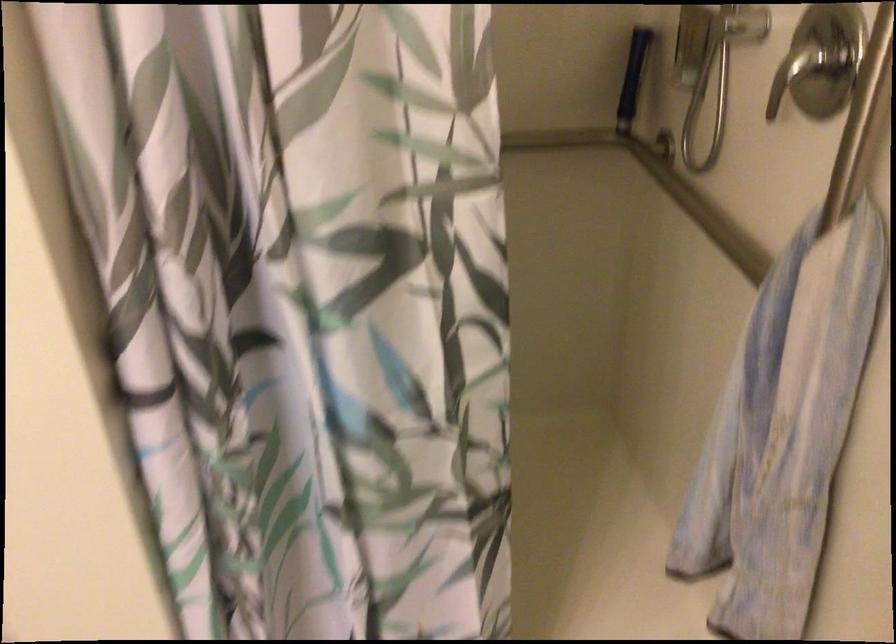
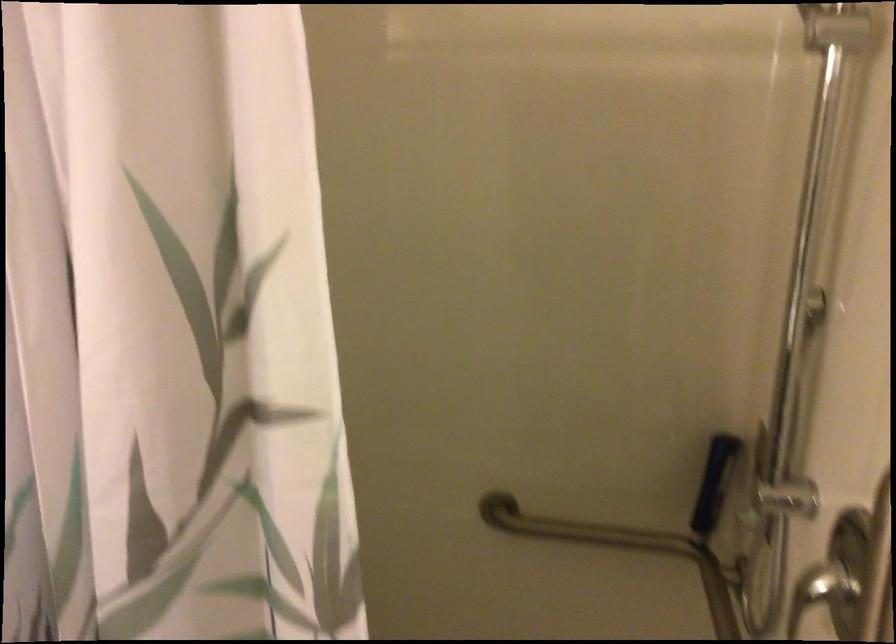
Question: The camera is either moving clockwise (left) or counter-clockwise (right) around the object. The first image is from the beginning of the video and the second image is from the end. Is the camera moving left or right when shooting the video?

Choices:
 (A) Left
 (B) Right

Answer: (B)